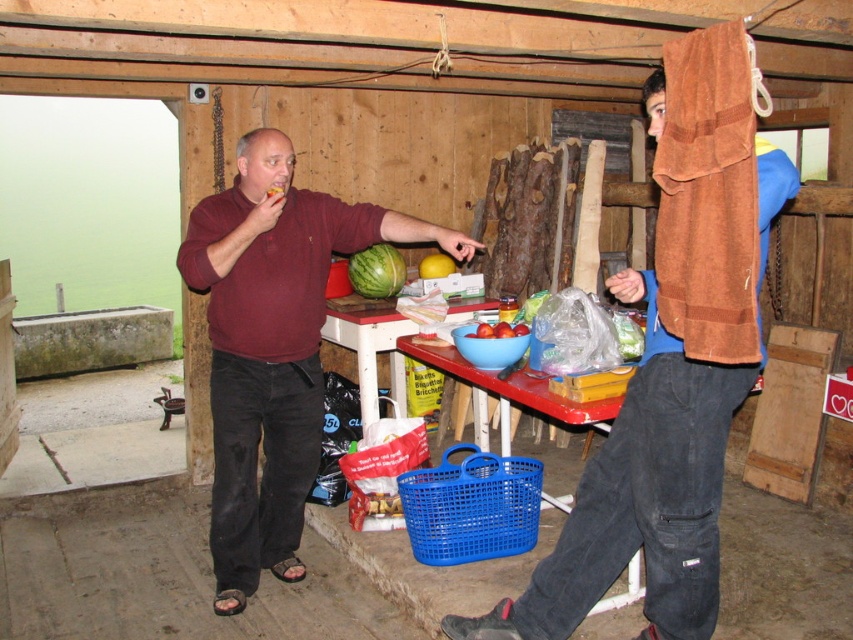
Can you confirm if wooden table at center is smaller than yellow matte lemon at center?

No, wooden table at center is not smaller than yellow matte lemon at center.

The height and width of the screenshot is (640, 853). Identify the location of wooden table at center. (369, 344).

Which is above, yellow matte lemon at center or smooth red apples at center?

yellow matte lemon at center is above.

Who is more distant from viewer, (427, 266) or (505, 323)?

The point (427, 266) is behind.

Locate an element on the screen. This screenshot has height=640, width=853. yellow matte lemon at center is located at coordinates (434, 266).

Which is behind, point (399, 356) or point (398, 253)?

The point (399, 356) is more distant.

In the scene shown: Is wooden table at center thinner than green matte watermelon at center?

In fact, wooden table at center might be wider than green matte watermelon at center.

Between point (343, 324) and point (396, 266), which one is positioned in front?

Positioned in front is point (343, 324).

Where is `wooden table at center`? The height and width of the screenshot is (640, 853). wooden table at center is located at coordinates (369, 344).